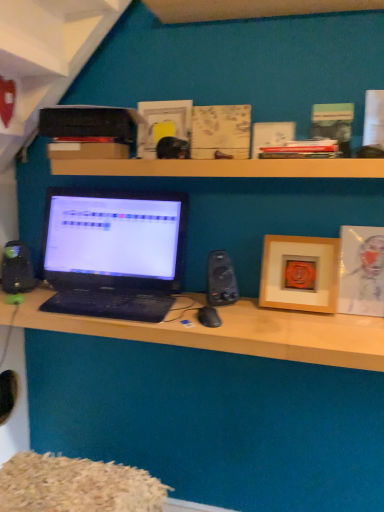
Question: From the image's perspective, would you say black plastic speaker at center-right, which is the 1th speaker in right-to-left order, is shown under black plastic speaker at left, acting as the first speaker starting from the left?

Choices:
 (A) yes
 (B) no

Answer: (A)

Question: Considering the relative sizes of black plastic speaker at center-right, which is the 1th speaker in right-to-left order, and black plastic speaker at left, acting as the first speaker starting from the left, in the image provided, is black plastic speaker at center-right, which is the 1th speaker in right-to-left order, wider than black plastic speaker at left, acting as the first speaker starting from the left,?

Choices:
 (A) yes
 (B) no

Answer: (B)

Question: Is the surface of black plastic speaker at center-right, the second speaker in the left-to-right sequence, in direct contact with black plastic speaker at left, acting as the first speaker starting from the left?

Choices:
 (A) no
 (B) yes

Answer: (A)

Question: From a real-world perspective, is black plastic speaker at center-right, which is the 1th speaker in right-to-left order, physically above black plastic speaker at left, which appears as the 2th speaker when viewed from the right?

Choices:
 (A) yes
 (B) no

Answer: (A)

Question: Would you say black plastic speaker at center-right, which is the 1th speaker in right-to-left order, is a long distance from black plastic speaker at left, which appears as the 2th speaker when viewed from the right?

Choices:
 (A) no
 (B) yes

Answer: (A)

Question: From the image's perspective, is wooden at upper center located above or below black matte mouse at center?

Choices:
 (A) below
 (B) above

Answer: (B)

Question: Based on their sizes in the image, would you say wooden at upper center is bigger or smaller than black matte mouse at center?

Choices:
 (A) big
 (B) small

Answer: (A)

Question: Is wooden at upper center in front of or behind black matte mouse at center in the image?

Choices:
 (A) front
 (B) behind

Answer: (A)

Question: In terms of height, does wooden at upper center look taller or shorter compared to black matte mouse at center?

Choices:
 (A) short
 (B) tall

Answer: (B)

Question: Is wooden picture frame at right, marked as the second picture frame in a right-to-left arrangement, inside the boundaries of black plastic speaker at left, which appears as the 2th speaker when viewed from the right, or outside?

Choices:
 (A) inside
 (B) outside

Answer: (B)

Question: Does point (283, 245) appear closer or farther from the camera than point (4, 253)?

Choices:
 (A) closer
 (B) farther

Answer: (B)

Question: From a real-world perspective, is wooden picture frame at right, marked as the second picture frame in a right-to-left arrangement, above or below black plastic speaker at left, which appears as the 2th speaker when viewed from the right?

Choices:
 (A) below
 (B) above

Answer: (B)

Question: Considering their positions, is wooden picture frame at right, which is the 1th picture frame in left-to-right order, located in front of or behind black plastic speaker at left, acting as the first speaker starting from the left?

Choices:
 (A) front
 (B) behind

Answer: (A)

Question: Is matte black laptop at center wider or thinner than matte wooden picture frame at right, which is counted as the second picture frame, starting from the left?

Choices:
 (A) thin
 (B) wide

Answer: (B)

Question: Considering their positions, is matte black laptop at center located in front of or behind matte wooden picture frame at right, arranged as the first picture frame when viewed from the right?

Choices:
 (A) front
 (B) behind

Answer: (A)